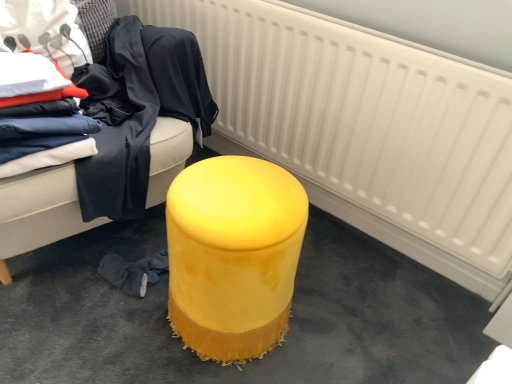
Question: Considering the relative sizes of velvet yellow stool at center and velvet yellow ottoman at center in the image provided, is velvet yellow stool at center wider than velvet yellow ottoman at center?

Choices:
 (A) yes
 (B) no

Answer: (B)

Question: Does velvet yellow stool at center have a lesser height compared to velvet yellow ottoman at center?

Choices:
 (A) no
 (B) yes

Answer: (B)

Question: From a real-world perspective, is velvet yellow stool at center beneath velvet yellow ottoman at center?

Choices:
 (A) no
 (B) yes

Answer: (B)

Question: Can you confirm if velvet yellow stool at center is positioned to the left of velvet yellow ottoman at center?

Choices:
 (A) yes
 (B) no

Answer: (B)

Question: Can you confirm if velvet yellow stool at center is positioned to the right of velvet yellow ottoman at center?

Choices:
 (A) no
 (B) yes

Answer: (B)

Question: Is white textured radiator at center taller or shorter than dark blue fabric at left, which ranks as the 2th clothing in right-to-left order?

Choices:
 (A) tall
 (B) short

Answer: (A)

Question: Is white textured radiator at center in front of or behind dark blue fabric at left, which is the 3th clothing in left-to-right order, in the image?

Choices:
 (A) front
 (B) behind

Answer: (A)

Question: Considering the positions of white textured radiator at center and dark blue fabric at left, which is the 3th clothing in left-to-right order, in the image, is white textured radiator at center wider or thinner than dark blue fabric at left, which is the 3th clothing in left-to-right order,?

Choices:
 (A) thin
 (B) wide

Answer: (A)

Question: Considering the positions of white textured radiator at center and dark blue fabric at left, which ranks as the 2th clothing in right-to-left order, in the image, is white textured radiator at center bigger or smaller than dark blue fabric at left, which ranks as the 2th clothing in right-to-left order,?

Choices:
 (A) big
 (B) small

Answer: (A)

Question: Is matte white fabric at upper left, the first clothing positioned from the left, taller or shorter than dark blue fabric at left, which ranks as the 2th clothing in right-to-left order?

Choices:
 (A) short
 (B) tall

Answer: (A)

Question: In the image, is matte white fabric at upper left, the first clothing positioned from the left, positioned in front of or behind dark blue fabric at left, which ranks as the 2th clothing in right-to-left order?

Choices:
 (A) behind
 (B) front

Answer: (A)

Question: Based on their positions, is matte white fabric at upper left, placed as the fourth clothing when sorted from right to left, located to the left or right of dark blue fabric at left, which is the 3th clothing in left-to-right order?

Choices:
 (A) right
 (B) left

Answer: (B)

Question: From the image's perspective, is matte white fabric at upper left, placed as the fourth clothing when sorted from right to left, positioned above or below dark blue fabric at left, which ranks as the 2th clothing in right-to-left order?

Choices:
 (A) below
 (B) above

Answer: (B)

Question: From a real-world perspective, is matte white fabric at upper left, placed as the fourth clothing when sorted from right to left, above or below velvet fabric clothes at left, the second clothing when ordered from left to right?

Choices:
 (A) below
 (B) above

Answer: (B)

Question: Is matte white fabric at upper left, placed as the fourth clothing when sorted from right to left, spatially inside velvet fabric clothes at left, placed as the 3th clothing when sorted from right to left, or outside of it?

Choices:
 (A) outside
 (B) inside

Answer: (A)